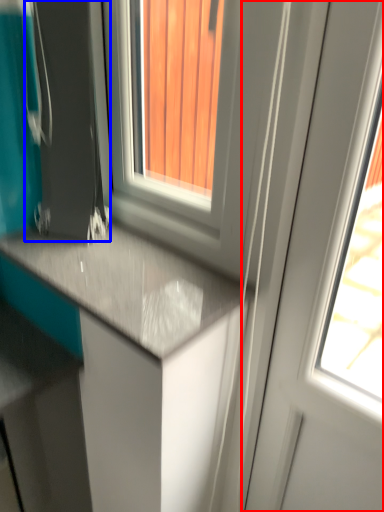
Question: Which point is closer to the camera, screen door (highlighted by a red box) or appliance (highlighted by a blue box)?

Choices:
 (A) screen door
 (B) appliance

Answer: (A)